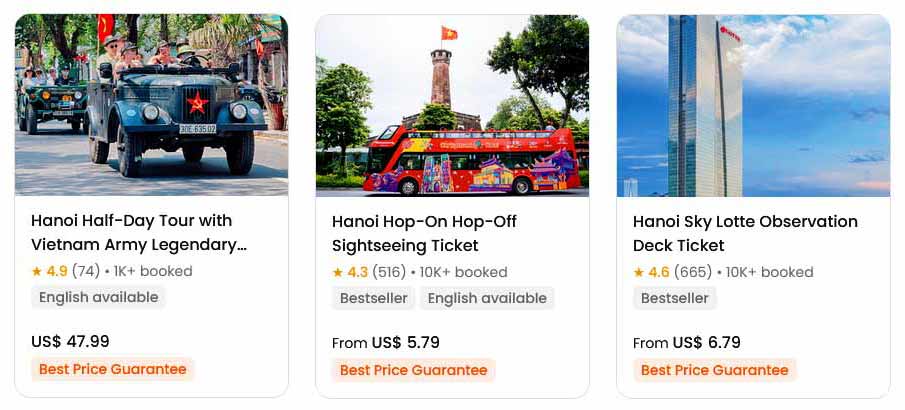
Identify the location of pictures. The image size is (905, 410). (135, 133), (535, 143), (795, 136).